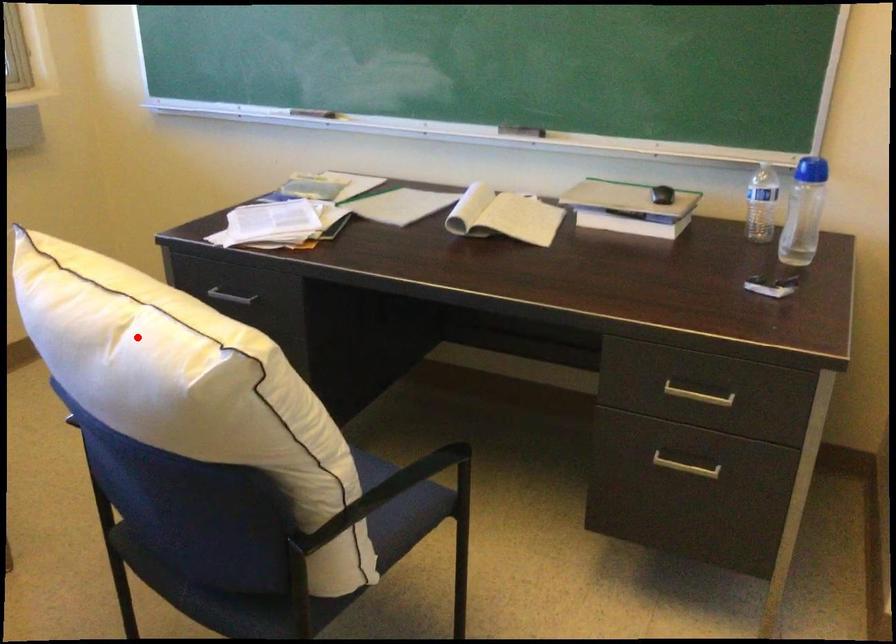
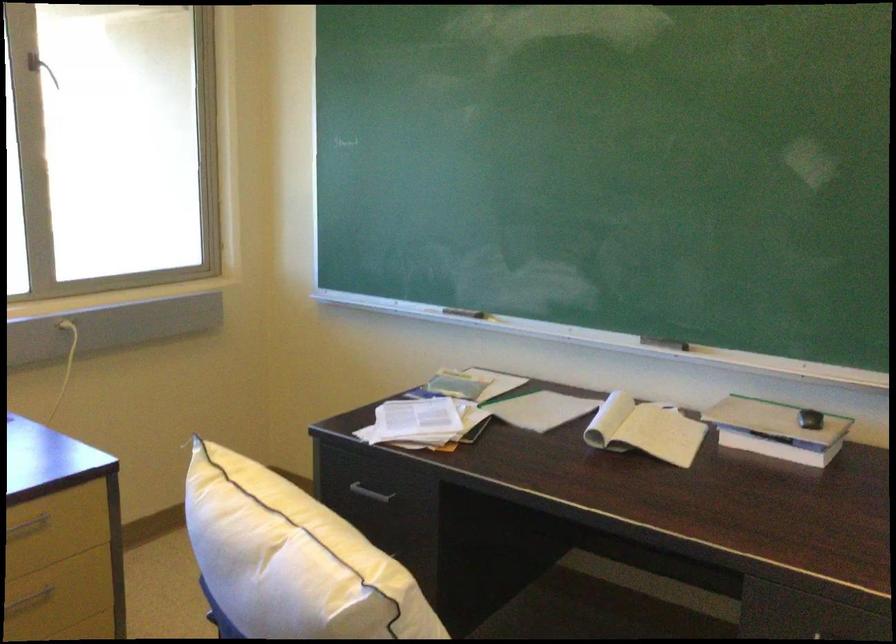
Find the pixel in the second image that matches the highlighted location in the first image.

(291, 559)